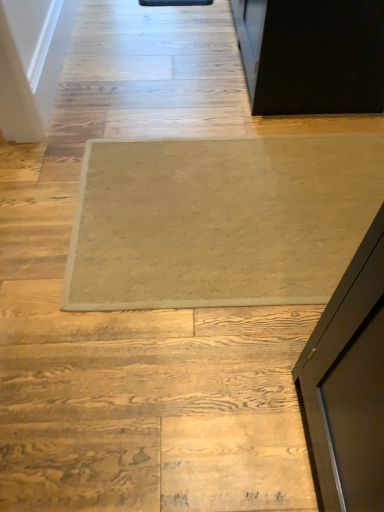
You are a GUI agent. You are given a task and a screenshot of the screen. Output one action in this format:
    pyautogui.click(x=<x>, y=<y>)
    Task: Click on the free spot above beige carpet at center (from a real-world perspective)
    This screenshot has height=512, width=384.
    Given the screenshot: What is the action you would take?
    pyautogui.click(x=177, y=149)